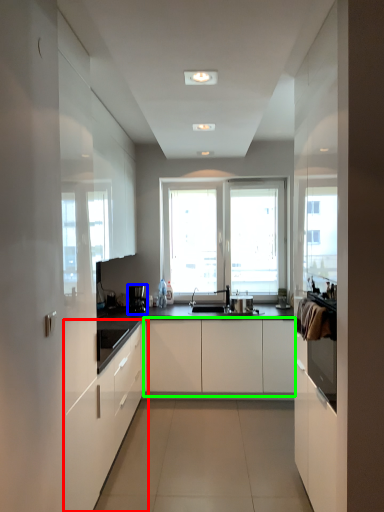
Question: Which is farther away from cabinetry (highlighted by a red box)? coffee machine (highlighted by a blue box) or cabinetry (highlighted by a green box)?

Choices:
 (A) coffee machine
 (B) cabinetry

Answer: (A)